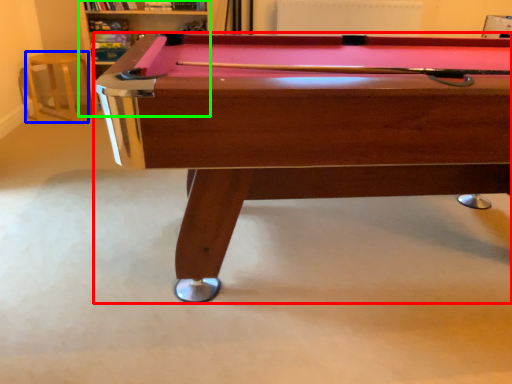
Question: Which object is positioned closest to billiard table (highlighted by a red box)? Select from bar stool (highlighted by a blue box) and shelf (highlighted by a green box).

Choices:
 (A) bar stool
 (B) shelf

Answer: (B)